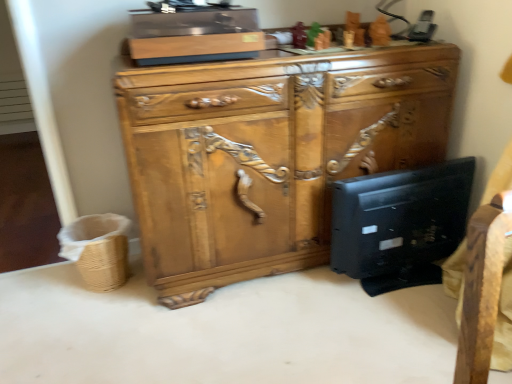
Question: Is wooden carved cabinet at center positioned with its back to woven brown basket at lower left?

Choices:
 (A) no
 (B) yes

Answer: (A)

Question: Can you confirm if wooden carved cabinet at center is bigger than woven brown basket at lower left?

Choices:
 (A) yes
 (B) no

Answer: (A)

Question: Is wooden carved cabinet at center positioned before woven brown basket at lower left?

Choices:
 (A) yes
 (B) no

Answer: (A)

Question: Is wooden carved cabinet at center shorter than woven brown basket at lower left?

Choices:
 (A) no
 (B) yes

Answer: (A)

Question: Are wooden carved cabinet at center and woven brown basket at lower left making contact?

Choices:
 (A) no
 (B) yes

Answer: (A)

Question: Based on their sizes in the image, would you say woven brown basket at lower left is bigger or smaller than wooden carved cabinet at center?

Choices:
 (A) small
 (B) big

Answer: (A)

Question: Is point (92, 266) closer or farther from the camera than point (168, 253)?

Choices:
 (A) farther
 (B) closer

Answer: (A)

Question: From the image's perspective, relative to wooden carved cabinet at center, is woven brown basket at lower left above or below?

Choices:
 (A) above
 (B) below

Answer: (B)

Question: Is woven brown basket at lower left wider or thinner than wooden carved cabinet at center?

Choices:
 (A) wide
 (B) thin

Answer: (B)

Question: Which is correct: woven brown basket at lower left is inside black matte desktop computer at lower right, or outside of it?

Choices:
 (A) inside
 (B) outside

Answer: (B)

Question: From their relative heights in the image, would you say woven brown basket at lower left is taller or shorter than black matte desktop computer at lower right?

Choices:
 (A) short
 (B) tall

Answer: (A)

Question: From a real-world perspective, is woven brown basket at lower left positioned above or below black matte desktop computer at lower right?

Choices:
 (A) below
 (B) above

Answer: (A)

Question: Is woven brown basket at lower left to the left or to the right of black matte desktop computer at lower right in the image?

Choices:
 (A) right
 (B) left

Answer: (B)

Question: Considering the positions of black matte desktop computer at lower right and wooden carved cabinet at center in the image, is black matte desktop computer at lower right bigger or smaller than wooden carved cabinet at center?

Choices:
 (A) small
 (B) big

Answer: (A)

Question: Relative to wooden carved cabinet at center, is black matte desktop computer at lower right in front or behind?

Choices:
 (A) front
 (B) behind

Answer: (B)